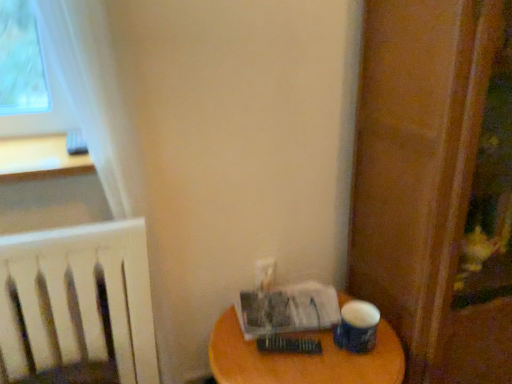
Identify the location of empty space that is to the right of hardcover book at center, marked as the first paperback book in a front-to-back arrangement. This screenshot has width=512, height=384. (348, 354).